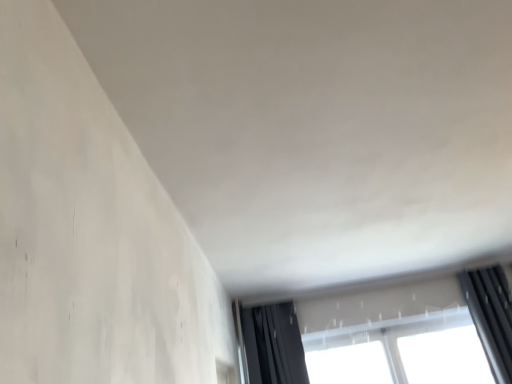
Question: Is black fabric curtain at upper right at the right side of transparent glass window at lower right?

Choices:
 (A) yes
 (B) no

Answer: (A)

Question: From a real-world perspective, is black fabric curtain at upper right under transparent glass window at lower right?

Choices:
 (A) no
 (B) yes

Answer: (B)

Question: Does black fabric curtain at upper right have a lesser height compared to transparent glass window at lower right?

Choices:
 (A) yes
 (B) no

Answer: (B)

Question: From the image's perspective, would you say black fabric curtain at upper right is positioned over transparent glass window at lower right?

Choices:
 (A) yes
 (B) no

Answer: (B)

Question: Is black fabric curtain at upper right in front of transparent glass window at lower right?

Choices:
 (A) no
 (B) yes

Answer: (B)

Question: Is black fabric curtain at upper right surrounding transparent glass window at lower right?

Choices:
 (A) yes
 (B) no

Answer: (B)

Question: Can you confirm if transparent glass window at lower right is positioned to the right of black fabric curtain at upper right?

Choices:
 (A) no
 (B) yes

Answer: (A)

Question: Are transparent glass window at lower right and black fabric curtain at upper right beside each other?

Choices:
 (A) no
 (B) yes

Answer: (A)

Question: Can you confirm if transparent glass window at lower right is smaller than black fabric curtain at upper right?

Choices:
 (A) yes
 (B) no

Answer: (A)

Question: From the image's perspective, would you say transparent glass window at lower right is shown under black fabric curtain at upper right?

Choices:
 (A) no
 (B) yes

Answer: (A)

Question: Is transparent glass window at lower right taller than black fabric curtain at upper right?

Choices:
 (A) no
 (B) yes

Answer: (A)

Question: Does transparent glass window at lower right have a greater width compared to black fabric curtain at upper right?

Choices:
 (A) yes
 (B) no

Answer: (B)

Question: Would you say black fabric curtain at upper right is to the left or to the right of transparent glass window at lower right in the picture?

Choices:
 (A) right
 (B) left

Answer: (A)